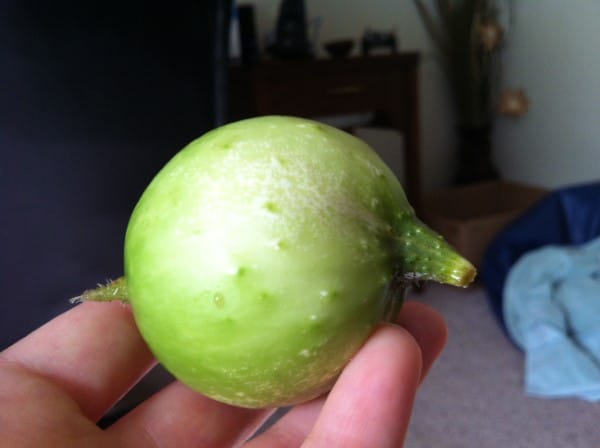
Locate an element on the screen. The image size is (600, 448). desk is located at coordinates (389, 85).